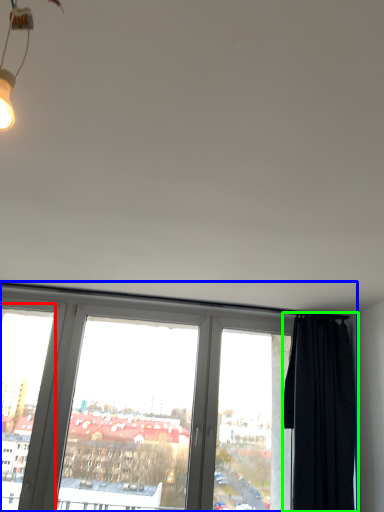
Question: Estimate the real-world distances between objects in this image. Which object is closer to window frame (highlighted by a red box), window (highlighted by a blue box) or curtain (highlighted by a green box)?

Choices:
 (A) window
 (B) curtain

Answer: (A)